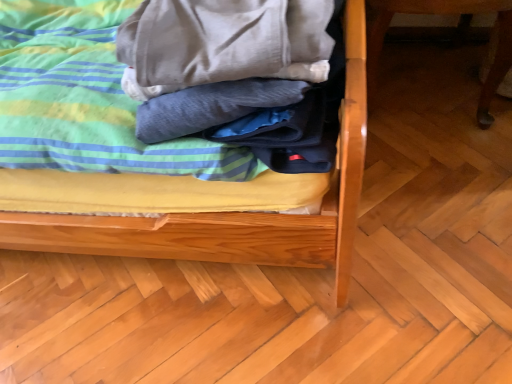
Question: Is soft cotton blanket at center placed right next to wooden table leg at right?

Choices:
 (A) no
 (B) yes

Answer: (A)

Question: Is soft cotton blanket at center oriented towards wooden table leg at right?

Choices:
 (A) no
 (B) yes

Answer: (A)

Question: Does soft cotton blanket at center have a lesser height compared to wooden table leg at right?

Choices:
 (A) no
 (B) yes

Answer: (B)

Question: Does soft cotton blanket at center have a lesser width compared to wooden table leg at right?

Choices:
 (A) no
 (B) yes

Answer: (B)

Question: Is soft cotton blanket at center located outside wooden table leg at right?

Choices:
 (A) no
 (B) yes

Answer: (B)

Question: Does point (489, 69) appear closer or farther from the camera than point (218, 183)?

Choices:
 (A) closer
 (B) farther

Answer: (B)

Question: Is wooden table leg at right taller or shorter than soft cotton bed at center?

Choices:
 (A) tall
 (B) short

Answer: (B)

Question: Would you say wooden table leg at right is to the left or to the right of soft cotton bed at center in the picture?

Choices:
 (A) left
 (B) right

Answer: (B)

Question: From the image's perspective, relative to soft cotton bed at center, is wooden table leg at right above or below?

Choices:
 (A) above
 (B) below

Answer: (A)

Question: Is point (18, 183) positioned closer to the camera than point (80, 61)?

Choices:
 (A) closer
 (B) farther

Answer: (A)

Question: Considering their positions, is soft cotton bed at center located in front of or behind soft cotton blanket at center?

Choices:
 (A) behind
 (B) front

Answer: (B)

Question: From a real-world perspective, relative to soft cotton blanket at center, is soft cotton bed at center vertically above or below?

Choices:
 (A) above
 (B) below

Answer: (B)

Question: Considering the relative positions of soft cotton bed at center and soft cotton blanket at center in the image provided, is soft cotton bed at center to the left or to the right of soft cotton blanket at center?

Choices:
 (A) left
 (B) right

Answer: (A)

Question: Considering their positions, is wooden table leg at right located in front of or behind soft cotton blanket at center?

Choices:
 (A) front
 (B) behind

Answer: (B)

Question: From a real-world perspective, is wooden table leg at right above or below soft cotton blanket at center?

Choices:
 (A) below
 (B) above

Answer: (A)